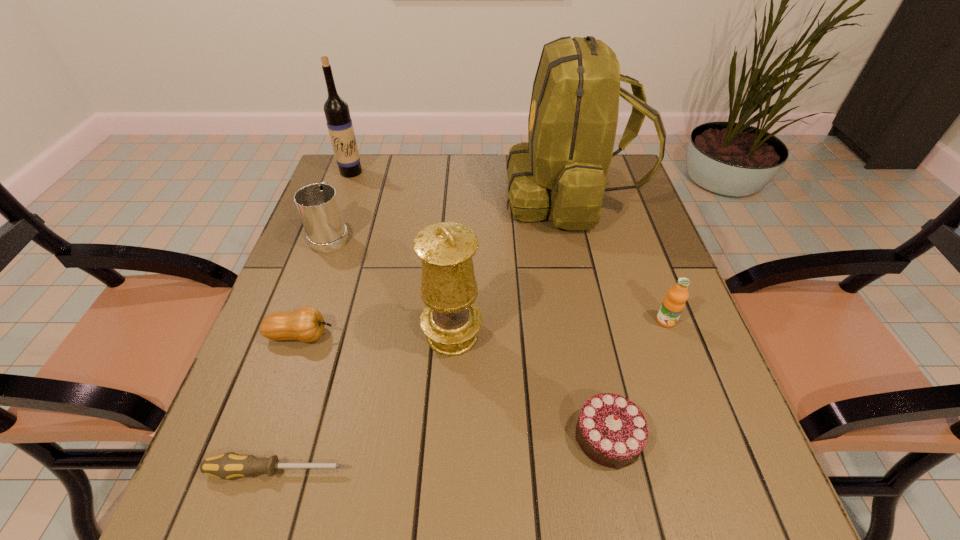
This screenshot has height=540, width=960. I want to click on vacant point located between the orange juice and the tallest object, so click(618, 258).

You are a GUI agent. You are given a task and a screenshot of the screen. Output one action in this format:
    pyautogui.click(x=<x>, y=<y>)
    Task: Click on the free space between the wine bottle and the gourd
    
    Given the screenshot: What is the action you would take?
    pyautogui.click(x=326, y=254)

Find the location of a particular element. free point between the tallest object and the wine bottle is located at coordinates (461, 184).

Locate an element on the screen. free space between the fourth object from right to left and the chocolate cake is located at coordinates (530, 386).

At what (x,y) coordinates should I click in order to perform the action: click on blank region between the mug and the wine bottle. Please return your answer as a coordinate pair (x, y). The width and height of the screenshot is (960, 540). Looking at the image, I should click on (341, 203).

At what (x,y) coordinates should I click in order to perform the action: click on free space that is in between the third tallest object and the gourd. Please return your answer as a coordinate pair (x, y). Looking at the image, I should click on coord(376,335).

This screenshot has height=540, width=960. In order to click on vacant point located between the chocolate cake and the shortest object in this screenshot , I will do `click(443, 454)`.

The height and width of the screenshot is (540, 960). In order to click on vacant area that lies between the orange juice and the sixth shortest object in this screenshot , I will do `click(559, 328)`.

Identify which object is the second closest to the shortest object. Please provide its 2D coordinates. Your answer should be formatted as a tuple, i.e. [(x, y)], where the tuple contains the x and y coordinates of a point satisfying the conditions above.

[(306, 324)]

Select which object appears as the fifth closest to the shortest object. Please provide its 2D coordinates. Your answer should be formatted as a tuple, i.e. [(x, y)], where the tuple contains the x and y coordinates of a point satisfying the conditions above.

[(562, 170)]